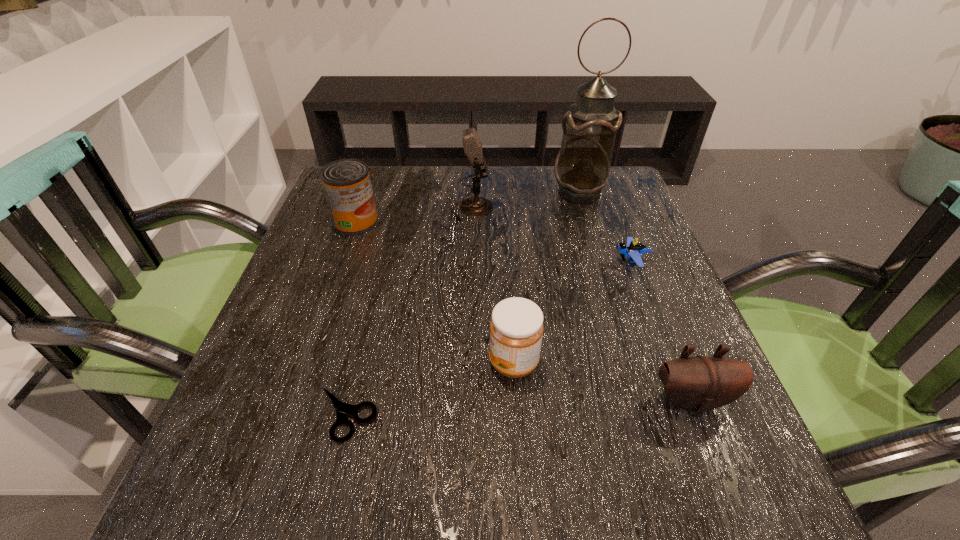
Locate an element on the screen. vacant area at the near edge is located at coordinates click(499, 495).

What are the coordinates of `free region at the right edge of the desktop` in the screenshot? It's located at (637, 232).

In the image, there is a desktop. Where is `free space at the near right corner`? The height and width of the screenshot is (540, 960). free space at the near right corner is located at coordinates (781, 514).

Where is `empty location between the second shortest object and the shortest object`? The width and height of the screenshot is (960, 540). empty location between the second shortest object and the shortest object is located at coordinates (489, 338).

The height and width of the screenshot is (540, 960). Find the location of `empty space between the can and the shortest object`. empty space between the can and the shortest object is located at coordinates (350, 318).

You are a GUI agent. You are given a task and a screenshot of the screen. Output one action in this format:
    pyautogui.click(x=<x>, y=<y>)
    Task: Click on the unoccupied area between the tallest object and the shortest object
    This screenshot has width=960, height=540.
    Given the screenshot: What is the action you would take?
    pyautogui.click(x=462, y=303)

Where is `empty space between the fourth farthest object and the shears`? empty space between the fourth farthest object and the shears is located at coordinates (489, 338).

I want to click on vacant area that lies between the jam and the shortest object, so click(429, 388).

The width and height of the screenshot is (960, 540). Identify the location of free space between the microphone and the fourth farthest object. (551, 235).

The image size is (960, 540). I want to click on empty space that is in between the jam and the tallest object, so click(x=546, y=278).